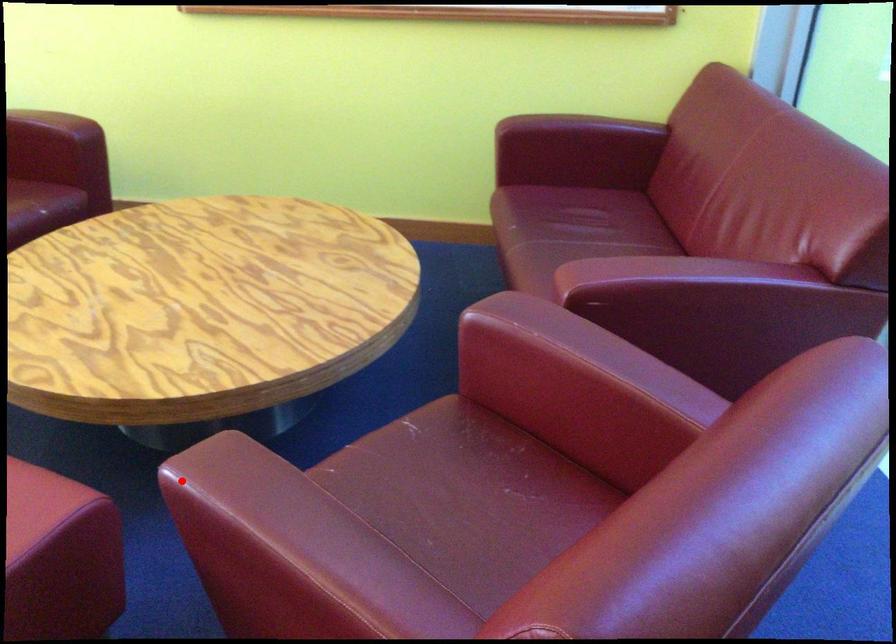
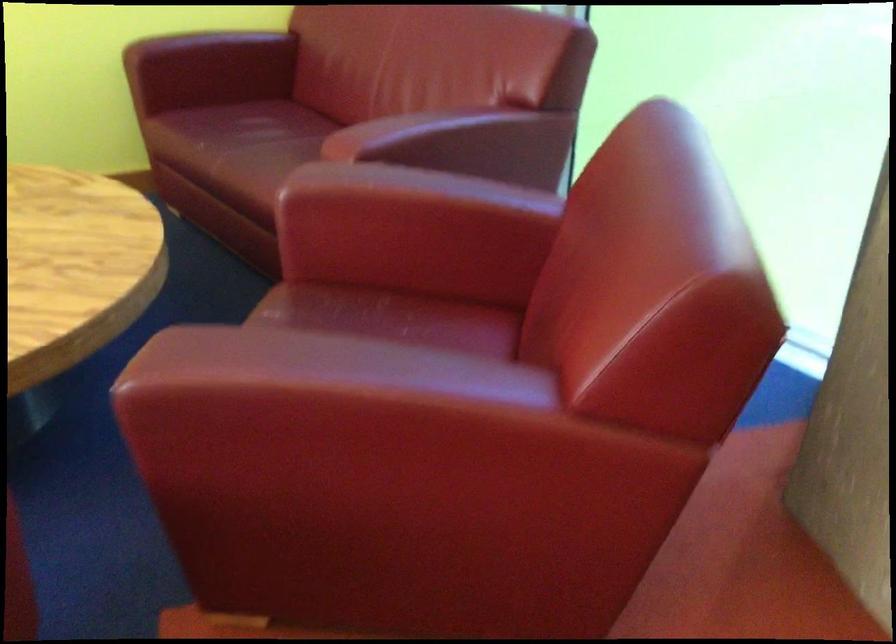
Question: I am providing you with two images of the same scene from different viewpoints. Given a red point in image1, look at the same physical point in image2. Is it:

Choices:
 (A) Closer to the viewpoint
 (B) Farther from the viewpoint

Answer: (A)